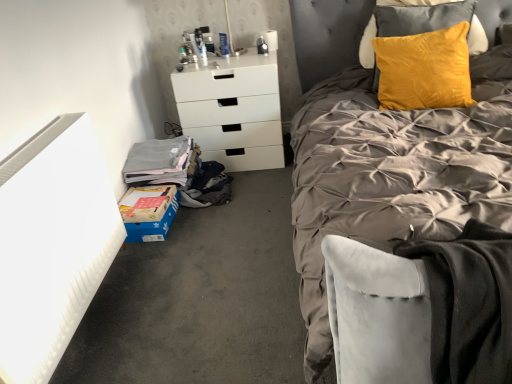
You are a GUI agent. You are given a task and a screenshot of the screen. Output one action in this format:
    pyautogui.click(x=<x>, y=<y>)
    Task: Click on the white matte chest of drawers at center
    The width and height of the screenshot is (512, 384).
    Given the screenshot: What is the action you would take?
    pyautogui.click(x=233, y=111)

Describe the element at coordinates (200, 299) in the screenshot. The width and height of the screenshot is (512, 384). I see `blue cardboard box at lower left` at that location.

Identify the location of blue cardboard box at lower left. This screenshot has height=384, width=512. (148, 212).

Describe the element at coordinates (327, 36) in the screenshot. I see `yellow velvet pillow at upper right` at that location.

Locate an element on the screen. Image resolution: width=512 pixels, height=384 pixels. silky gray duvet at center is located at coordinates (393, 174).

Based on their sizes in the image, would you say yellow velvet pillow at upper right is bigger or smaller than white matte chest of drawers at center?

Clearly, yellow velvet pillow at upper right is smaller in size than white matte chest of drawers at center.

Is yellow velvet pillow at upper right positioned beyond the bounds of white matte chest of drawers at center?

Yes, yellow velvet pillow at upper right is located beyond the bounds of white matte chest of drawers at center.

Is yellow velvet pillow at upper right wider or thinner than white matte chest of drawers at center?

yellow velvet pillow at upper right is thinner than white matte chest of drawers at center.

Is the position of yellow velvet pillow at upper right less distant than that of white matte chest of drawers at center?

That is True.

Do you think blue cardboard box at lower left is within white matte chest of drawers at center, or outside of it?

blue cardboard box at lower left is not inside white matte chest of drawers at center, it's outside.

Would you consider blue cardboard box at lower left to be distant from white matte chest of drawers at center?

No, blue cardboard box at lower left is not far from white matte chest of drawers at center.

In terms of size, does blue cardboard box at lower left appear bigger or smaller than white matte chest of drawers at center?

In the image, blue cardboard box at lower left appears to be smaller than white matte chest of drawers at center.

Is white matte chest of drawers at center at the back of blue cardboard box at lower left?

No, blue cardboard box at lower left is not facing the opposite direction of white matte chest of drawers at center.

The height and width of the screenshot is (384, 512). I want to click on headboard above the blue cardboard box at lower left (from a real-world perspective), so pos(327,36).

Is yellow velvet pillow at upper right bigger or smaller than blue cardboard box at lower left?

In the image, yellow velvet pillow at upper right appears to be larger than blue cardboard box at lower left.

Considering the relative positions of yellow velvet pillow at upper right and blue cardboard box at lower left in the image provided, is yellow velvet pillow at upper right to the left or to the right of blue cardboard box at lower left?

In the image, yellow velvet pillow at upper right appears on the right side of blue cardboard box at lower left.

Is yellow velvet pillow at upper right wider than blue cardboard box at lower left?

Correct, the width of yellow velvet pillow at upper right exceeds that of blue cardboard box at lower left.

From the image's perspective, between white matte chest of drawers at center and blue cardboard box at lower left, which one is located above?

white matte chest of drawers at center appears higher in the image.

Which object is closer to the camera taking this photo, white matte chest of drawers at center or blue cardboard box at lower left?

blue cardboard box at lower left is closer to the camera.

Which object is wider, white matte chest of drawers at center or blue cardboard box at lower left?

blue cardboard box at lower left.

In terms of size, does white matte chest of drawers at center appear bigger or smaller than blue cardboard box at lower left?

Clearly, white matte chest of drawers at center is larger in size than blue cardboard box at lower left.

From a real-world perspective, who is located lower, silky gray duvet at center or blue cardboard box at lower left?

blue cardboard box at lower left.

Does silky gray duvet at center turn towards blue cardboard box at lower left?

No, silky gray duvet at center is not turned towards blue cardboard box at lower left.

Which of these two, silky gray duvet at center or blue cardboard box at lower left, is bigger?

silky gray duvet at center.

From a real-world perspective, between silky gray duvet at center and yellow velvet pillow at upper right, who is vertically lower?

silky gray duvet at center.

Is silky gray duvet at center positioned with its back to yellow velvet pillow at upper right?

Yes, silky gray duvet at center is facing away from yellow velvet pillow at upper right.

Does silky gray duvet at center have a lesser height compared to yellow velvet pillow at upper right?

No.

Is point (328, 224) positioned behind point (305, 17)?

That is False.

Which is more to the left, white matte chest of drawers at center or yellow velvet pillow at upper right?

white matte chest of drawers at center is more to the left.

Does white matte chest of drawers at center contain yellow velvet pillow at upper right?

That's incorrect, yellow velvet pillow at upper right is not inside white matte chest of drawers at center.

Which is behind, white matte chest of drawers at center or yellow velvet pillow at upper right?

Positioned behind is white matte chest of drawers at center.

Find the location of a particular element. This screenshot has height=384, width=512. headboard on the right of white matte chest of drawers at center is located at coordinates (327, 36).

This screenshot has width=512, height=384. In order to click on concrete that appears below the white matte chest of drawers at center (from the image's perspective) in this screenshot , I will do `click(200, 299)`.

Considering their positions, is yellow velvet pillow at upper right positioned closer to blue cardboard box at lower left than silky gray duvet at center?

silky gray duvet at center.

From the image, which object appears to be farther from blue cardboard box at lower left, silky gray duvet at center or yellow velvet pillow at upper right?

Based on the image, yellow velvet pillow at upper right appears to be further to blue cardboard box at lower left.

Which object lies nearer to the anchor point silky gray duvet at center, yellow velvet pillow at upper right or white matte chest of drawers at center?

Among the two, white matte chest of drawers at center is located nearer to silky gray duvet at center.

From the image, which object appears to be farther from blue cardboard box at lower left, yellow velvet pillow at upper right or white matte chest of drawers at center?

yellow velvet pillow at upper right lies further to blue cardboard box at lower left than the other object.

Looking at the image, which one is located closer to yellow velvet pillow at upper right, blue cardboard box at lower left or white matte chest of drawers at center?

white matte chest of drawers at center.

Considering their positions, is blue cardboard box at lower left positioned closer to yellow velvet pillow at upper right than blue cardboard box at lower left?

blue cardboard box at lower left is positioned closer to the anchor yellow velvet pillow at upper right.

Considering their positions, is blue cardboard box at lower left positioned closer to blue cardboard box at lower left than silky gray duvet at center?

blue cardboard box at lower left is closer to blue cardboard box at lower left.

Estimate the real-world distances between objects in this image. Which object is further from white matte chest of drawers at center, blue cardboard box at lower left or yellow velvet pillow at upper right?

Based on the image, blue cardboard box at lower left appears to be further to white matte chest of drawers at center.

Locate an element on the screen. Image resolution: width=512 pixels, height=384 pixels. chest of drawers between blue cardboard box at lower left and yellow velvet pillow at upper right from left to right is located at coordinates (233, 111).

Locate an element on the screen. This screenshot has width=512, height=384. cardboard box positioned between blue cardboard box at lower left and white matte chest of drawers at center from near to far is located at coordinates (148, 212).

Locate an element on the screen. The height and width of the screenshot is (384, 512). chest of drawers between blue cardboard box at lower left and yellow velvet pillow at upper right is located at coordinates (233, 111).

Where is `concrete between silky gray duvet at center and yellow velvet pillow at upper right from front to back`? concrete between silky gray duvet at center and yellow velvet pillow at upper right from front to back is located at coordinates (200, 299).